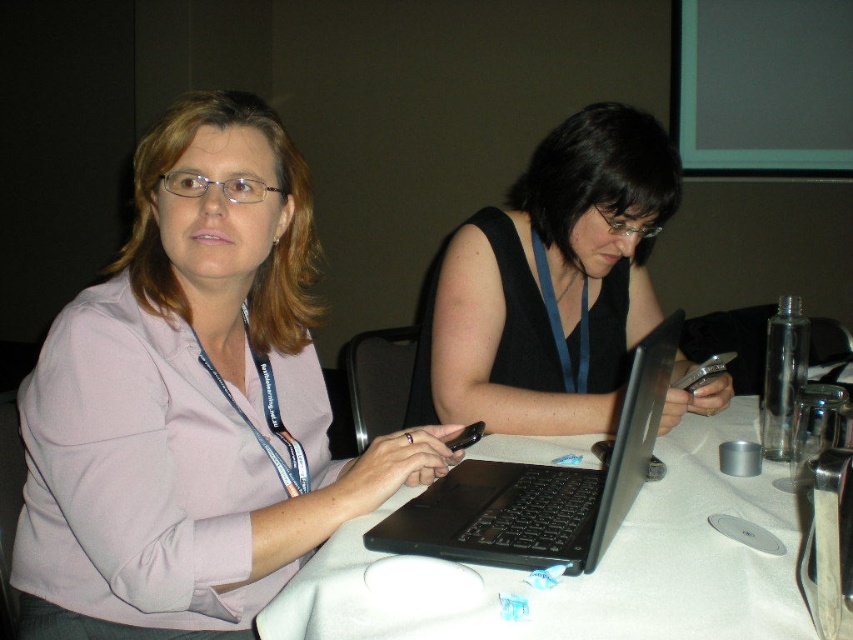
You are a photographer setting up for a group photo. The photographer needs to ensure that the black matte tank top at center is visible in the frame. Where should you position the camera relative to the table?

The black matte tank top at center is located at coordinates point (550, 284). To ensure visibility, position the camera so it captures the area around those coordinates on the table.

You are organizing a photoshoot and need to ensure that the matte pink shirt at center and the black matte tank top at center are positioned correctly according to the scene. Based on their positions, which item is closer to the camera?

The matte pink shirt at center is closer to the camera because it is in front of the black matte tank top at center.

You are organizing a clothing donation drive and need to determine which item takes up more space. Based on the image, which clothing item is larger in size between the matte pink shirt at center and the black matte tank top at center?

The matte pink shirt at center is bigger than the black matte tank top at center, so it takes up more space.